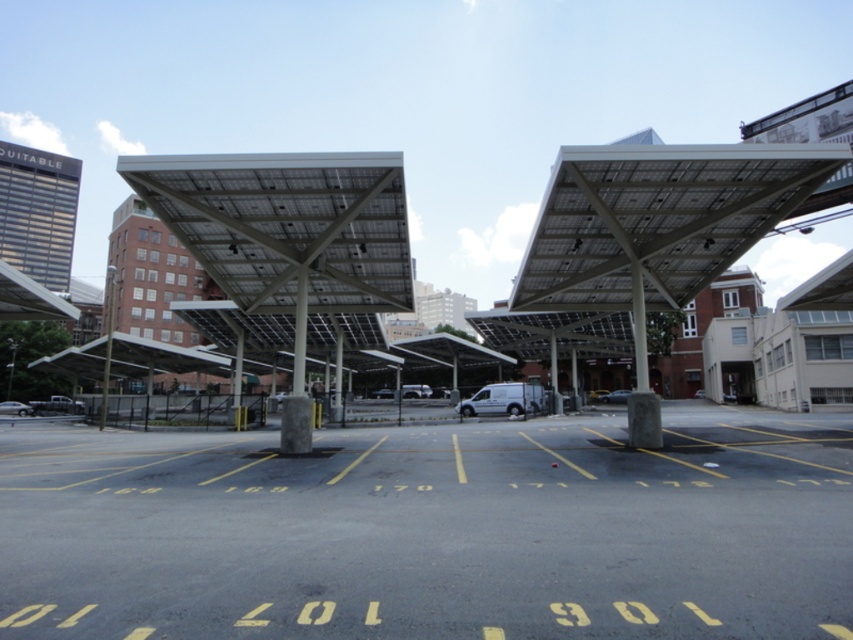
Between black asphalt parking lot at center and metallic silver sedan at center, which one appears on the right side from the viewer's perspective?

metallic silver sedan at center is more to the right.

Who is shorter, black asphalt parking lot at center or metallic silver sedan at center?

Standing shorter between the two is metallic silver sedan at center.

Find the location of a particular element. Image resolution: width=853 pixels, height=640 pixels. black asphalt parking lot at center is located at coordinates (433, 531).

Image resolution: width=853 pixels, height=640 pixels. In order to click on black asphalt parking lot at center in this screenshot , I will do `click(433, 531)`.

Is point (815, 486) closer to camera compared to point (16, 401)?

Yes, it is in front of point (16, 401).

Does point (352, 448) come behind point (10, 406)?

No, it is not.

Locate an element on the screen. The height and width of the screenshot is (640, 853). black asphalt parking lot at center is located at coordinates (433, 531).

Does point (0, 406) come closer to viewer compared to point (598, 397)?

Yes, point (0, 406) is closer to viewer.

Is point (0, 404) less distant than point (607, 396)?

Yes, it is in front of point (607, 396).

The width and height of the screenshot is (853, 640). Identify the location of silver metallic car at lower left. (15, 408).